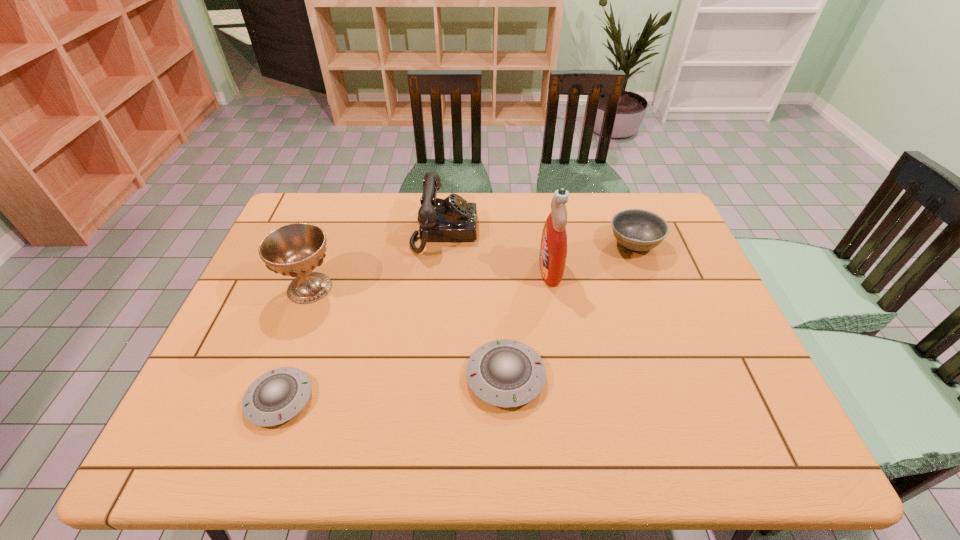
Please point a spot on the right to add another saucer. Please provide its 2D coordinates. Your answer should be formatted as a tuple, i.e. [(x, y)], where the tuple contains the x and y coordinates of a point satisfying the conditions above.

[(713, 355)]